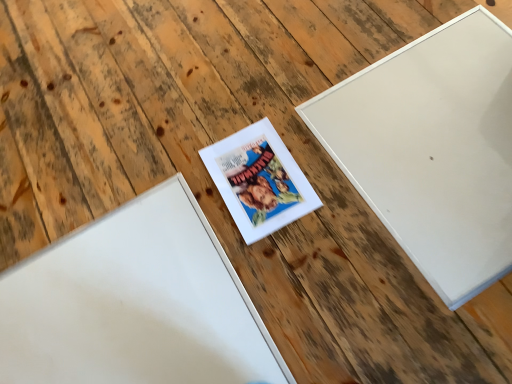
Where is `free space above white matte picture frame at upper right, arranged as the first picture frame when viewed from the right (from a real-world perspective)`? The image size is (512, 384). free space above white matte picture frame at upper right, arranged as the first picture frame when viewed from the right (from a real-world perspective) is located at coordinates (436, 140).